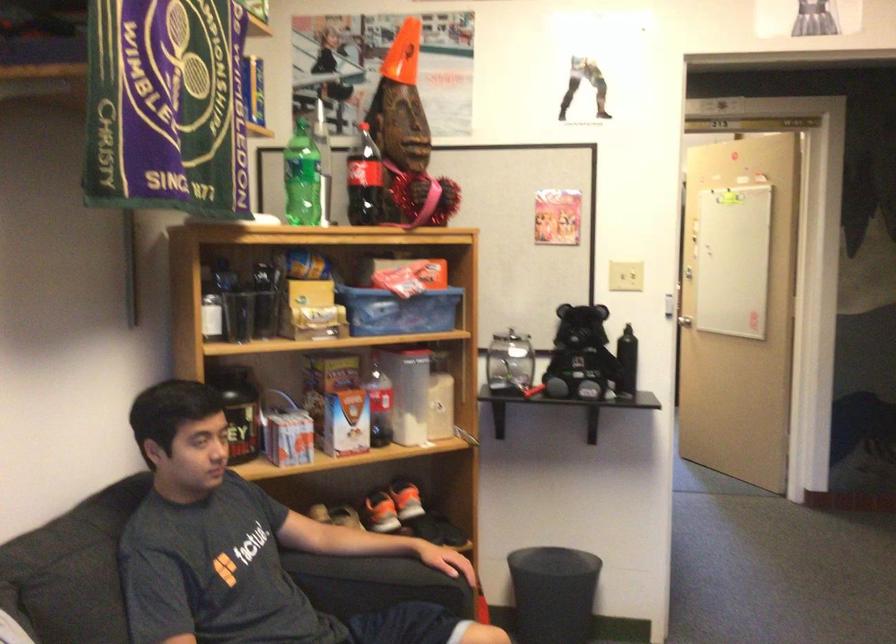
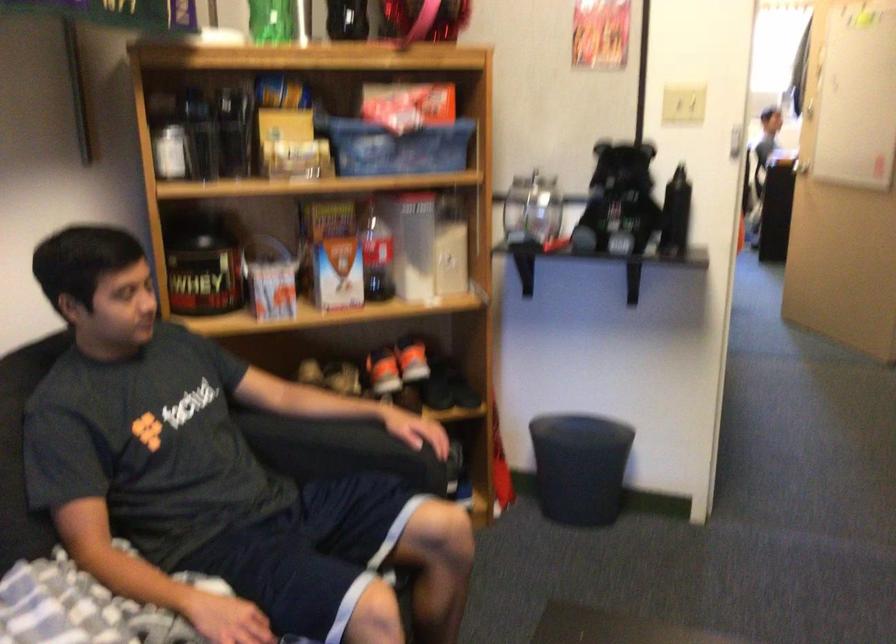
Locate, in the second image, the point that corresponds to [380,404] in the first image.

(375, 254)